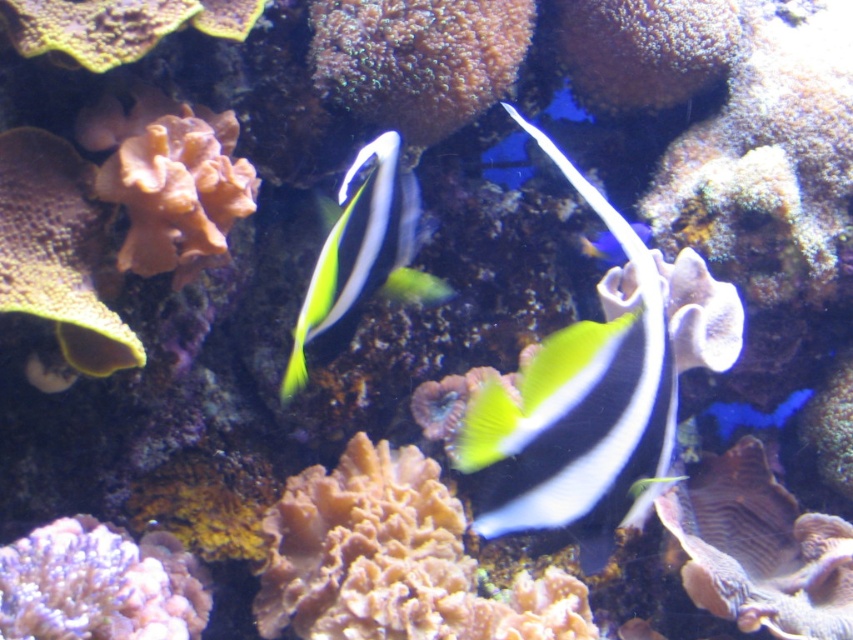
Which is more to the right, rusty brown coral at center or pink coral at lower left?

rusty brown coral at center

Between rusty brown coral at center and pink coral at lower left, which one is positioned higher?

pink coral at lower left is above.

The width and height of the screenshot is (853, 640). What are the coordinates of `rusty brown coral at center` in the screenshot? It's located at (393, 561).

Can you confirm if pink coral at lower left is thinner than yellow-green glossy fish at center?

No, pink coral at lower left is not thinner than yellow-green glossy fish at center.

Which is more to the left, pink coral at lower left or yellow-green glossy fish at center?

Positioned to the left is pink coral at lower left.

The image size is (853, 640). Identify the location of pink coral at lower left. (97, 586).

Who is positioned more to the left, rusty brown coral at center or green textured coral at center?

rusty brown coral at center is more to the left.

Is rusty brown coral at center wider than green textured coral at center?

Yes, rusty brown coral at center is wider than green textured coral at center.

I want to click on rusty brown coral at center, so click(x=393, y=561).

Find the location of a particular element. The width and height of the screenshot is (853, 640). rusty brown coral at center is located at coordinates (393, 561).